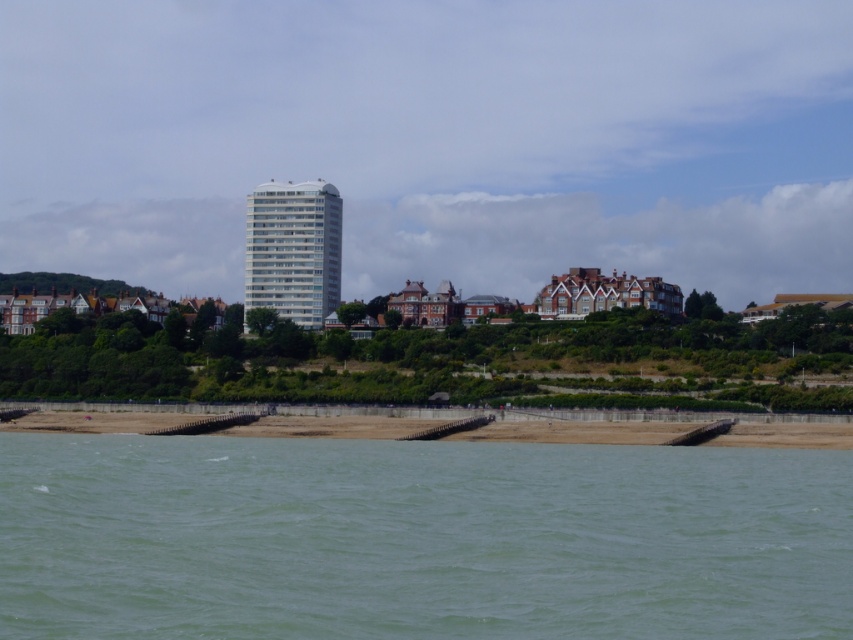
You are standing on the beach and want to reach the green water at lower center. Based on the coordinates provided, in which direction should you walk from your current position to reach it?

The green water at lower center is located at coordinates point (419, 538). Since the coordinate system typically places the origin at the bottom left corner, you should walk towards the right and slightly upwards to reach it.

You are standing on the beach looking out at the scene. There is green water at lower center and brown sand at lower center. Which one is located to the right side from your perspective?

The green water at lower center is located to the right of the brown sand at lower center.

You are a lifeguard on duty and need to assess the distance between the green water at lower center and the brown sand at lower center. Which area is narrower in width?

The green water at lower center is thinner than the brown sand at lower center, so the green water is narrower in width.